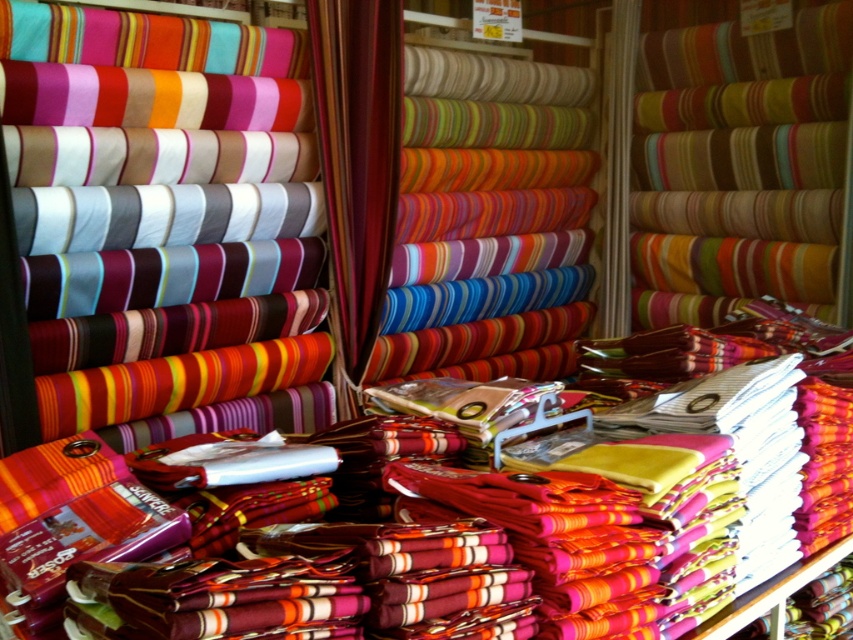
Question: Does multicolored striped fabric at center appear over silky striped fabric at center?

Choices:
 (A) yes
 (B) no

Answer: (A)

Question: Which of the following is the closest to the observer?

Choices:
 (A) silky striped fabric at center
 (B) multicolored striped fabric at center

Answer: (A)

Question: Considering the relative positions of multicolored striped fabric at center and silky striped fabric at center in the image provided, where is multicolored striped fabric at center located with respect to silky striped fabric at center?

Choices:
 (A) above
 (B) below

Answer: (A)

Question: Which object is farther from the camera taking this photo?

Choices:
 (A) multicolored striped fabric at center
 (B) silky striped fabric at center

Answer: (A)

Question: Is multicolored striped fabric at center above silky striped fabric at center?

Choices:
 (A) no
 (B) yes

Answer: (B)